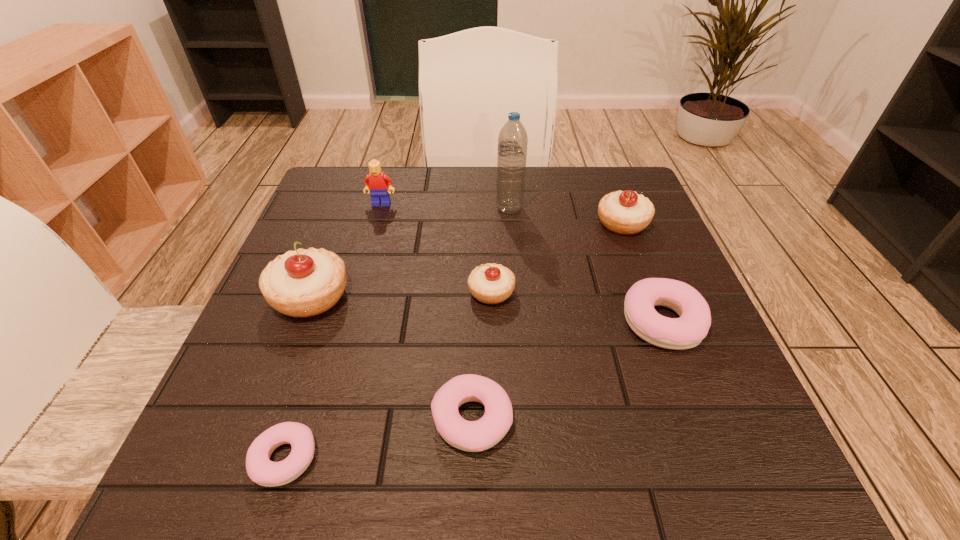
Where is `blank region between the biggest beige pastry and the tallest object`? The height and width of the screenshot is (540, 960). blank region between the biggest beige pastry and the tallest object is located at coordinates (410, 252).

Where is `unoccupied position between the farthest beige pastry and the blue water bottle`? unoccupied position between the farthest beige pastry and the blue water bottle is located at coordinates (565, 215).

Identify the location of free space between the second pink pastry from left to right and the smallest pink pastry. (378, 438).

You are a GUI agent. You are given a task and a screenshot of the screen. Output one action in this format:
    pyautogui.click(x=<x>, y=<y>)
    Task: Click on the vacant region between the sixth tallest object and the fifth shortest pastry
    The width and height of the screenshot is (960, 540).
    Given the screenshot: What is the action you would take?
    pyautogui.click(x=642, y=272)

Image resolution: width=960 pixels, height=540 pixels. I want to click on empty space that is in between the Lego and the farthest beige pastry, so click(x=502, y=213).

Find the location of `empty space between the Lego and the smallest pink pastry`. empty space between the Lego and the smallest pink pastry is located at coordinates (333, 331).

At what (x,y) coordinates should I click in order to perform the action: click on object that is the third closest to the biggest beige pastry. Please return your answer as a coordinate pair (x, y). The height and width of the screenshot is (540, 960). Looking at the image, I should click on (376, 182).

Identify the location of object that stands as the fifth closest to the fifth tallest object. (624, 212).

Where is `the closest pastry to the smallest beige pastry`? the closest pastry to the smallest beige pastry is located at coordinates (473, 436).

Identify which pastry is the third nearest to the third shortest pastry. Please provide its 2D coordinates. Your answer should be formatted as a tuple, i.e. [(x, y)], where the tuple contains the x and y coordinates of a point satisfying the conditions above.

[(473, 436)]